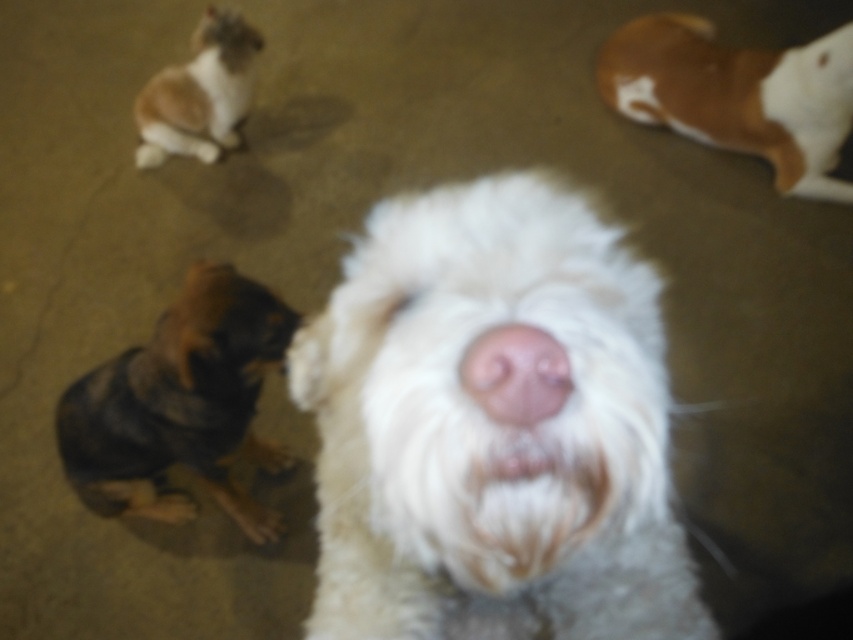
From the picture: You are a photographer trying to capture a group photo of the brown fur at upper right and the pink soft nose at center. Based on their positions, which dog should you focus on first to ensure both are in frame?

The brown fur at upper right is positioned on the right side of pink soft nose at center. To ensure both are in frame, you should focus on the pink soft nose at center first as it is centrally located and the brown fur at upper right is to its right, allowing you to adjust the frame to include both.

You are standing in the indoor setting where the dogs are. You see two points marked as point 1 at (x=386, y=502) and point 2 at (x=192, y=83). Which point is closer to your position?

Point 1 at (x=386, y=502) is closer to your position because it is closer to the camera than point 2 at (x=192, y=83).